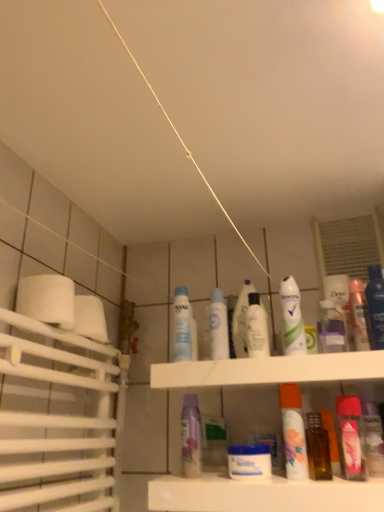
What is the approximate height of pink glossy mouthwash at lower right, which is the eighth mouthwash from left to right?

pink glossy mouthwash at lower right, which is the eighth mouthwash from left to right, is 7.21 inches tall.

This screenshot has width=384, height=512. I want to click on translucent plastic spray bottle at upper center, so pos(331,329).

In order to face purple matte mouthwash at center, the 8th mouthwash from the right, should I rotate leftwards or rightwards?

You should rotate left by 0.567 degrees.

The image size is (384, 512). Describe the element at coordinates (359, 314) in the screenshot. I see `translucent plastic mouthwash at upper right, which is the 9th mouthwash in left-to-right order` at that location.

I want to click on pink glossy mouthwash at lower right, which is the eighth mouthwash from left to right, so click(351, 436).

Is white matte toilet paper at left positioned with its back to transparent plastic mouthwash at center, the first mouthwash viewed from the left?

white matte toilet paper at left is not turned away from transparent plastic mouthwash at center, the first mouthwash viewed from the left.

Identify the location of toilet paper that appears above the transparent plastic mouthwash at center, which is the 9th mouthwash in right-to-left order (from a real-world perspective). (47, 298).

How much distance is there between white matte toilet paper at left and transparent plastic mouthwash at center, the first mouthwash viewed from the left?

white matte toilet paper at left and transparent plastic mouthwash at center, the first mouthwash viewed from the left, are 11.15 inches apart from each other.

In terms of height, does white matte toilet paper at left look taller or shorter compared to transparent plastic mouthwash at center, which is the 9th mouthwash in right-to-left order?

Considering their sizes, white matte toilet paper at left has less height than transparent plastic mouthwash at center, which is the 9th mouthwash in right-to-left order.

Which is in front, green matte mouthwash at upper center, the 3th mouthwash viewed from the right, or translucent plastic mouthwash at upper right, which is the 9th mouthwash in left-to-right order?

green matte mouthwash at upper center, the 3th mouthwash viewed from the right, is closer to the camera.

From a real-world perspective, which object rests below the other?

In real-world perspective, translucent plastic mouthwash at upper right, which is the 9th mouthwash in left-to-right order, is lower.

Locate an element on the screen. the 1st mouthwash directly beneath the green matte mouthwash at upper center, which is the 7th mouthwash in left-to-right order (from a real-world perspective) is located at coordinates (359, 314).

Is green matte mouthwash at upper center, the 3th mouthwash viewed from the right, spatially inside translucent plastic mouthwash at upper right, the first mouthwash from the right, or outside of it?

green matte mouthwash at upper center, the 3th mouthwash viewed from the right, is outside translucent plastic mouthwash at upper right, the first mouthwash from the right.

Considering the sizes of white glossy mouthwash at center, marked as the seventh mouthwash in a right-to-left arrangement, and white matte toilet paper at left in the image, is white glossy mouthwash at center, marked as the seventh mouthwash in a right-to-left arrangement, taller or shorter than white matte toilet paper at left?

white glossy mouthwash at center, marked as the seventh mouthwash in a right-to-left arrangement, is taller than white matte toilet paper at left.

Choose the correct answer: Is white glossy mouthwash at center, marked as the seventh mouthwash in a right-to-left arrangement, inside white matte toilet paper at left or outside it?

white glossy mouthwash at center, marked as the seventh mouthwash in a right-to-left arrangement, is not enclosed by white matte toilet paper at left.

Does white glossy mouthwash at center, which ranks as the 3th mouthwash in left-to-right order, appear on the right side of white matte toilet paper at left?

→ Correct, you'll find white glossy mouthwash at center, which ranks as the 3th mouthwash in left-to-right order, to the right of white matte toilet paper at left.

Is point (256, 348) closer or farther from the camera than point (32, 302)?

Point (256, 348) is positioned farther from the camera compared to point (32, 302).

You are a GUI agent. You are given a task and a screenshot of the screen. Output one action in this format:
    pyautogui.click(x=<x>, y=<y>)
    Task: Click on the toilet paper above the white glossy mouthwash at center, the fifth mouthwash in the left-to-right sequence (from the image's perspective)
    This screenshot has height=512, width=384.
    Given the screenshot: What is the action you would take?
    pyautogui.click(x=47, y=298)

How different are the orientations of white glossy mouthwash at center, the fifth mouthwash in the left-to-right sequence, and white matte toilet paper at left in degrees?

The angular difference between white glossy mouthwash at center, the fifth mouthwash in the left-to-right sequence, and white matte toilet paper at left is 90 degrees.

Does white glossy mouthwash at center, the fifth mouthwash in the left-to-right sequence, appear on the right side of white matte toilet paper at left?

Yes, white glossy mouthwash at center, the fifth mouthwash in the left-to-right sequence, is to the right of white matte toilet paper at left.

From a real-world perspective, is translucent plastic spray bottle at upper center physically located above or below white plastic shelf at center?

Clearly, from a real-world perspective, translucent plastic spray bottle at upper center is above white plastic shelf at center.

Which of these two, translucent plastic spray bottle at upper center or white plastic shelf at center, stands taller?

Standing taller between the two is white plastic shelf at center.

The width and height of the screenshot is (384, 512). I want to click on shelf below the translucent plastic spray bottle at upper center (from the image's perspective), so click(x=262, y=495).

Could white plastic shelf at center be considered to be inside translucent plastic spray bottle at upper center?

No, translucent plastic spray bottle at upper center does not contain white plastic shelf at center.

The image size is (384, 512). What are the coordinates of `the 4th mouthwash directly beneath the translucent plastic mouthwash at upper right, which is the 9th mouthwash in left-to-right order (from a real-world perspective)` in the screenshot? It's located at (351, 436).

From a real-world perspective, which is physically above, pink glossy mouthwash at lower right, the second mouthwash when ordered from right to left, or translucent plastic mouthwash at upper right, the first mouthwash from the right?

translucent plastic mouthwash at upper right, the first mouthwash from the right, is physically above.

Does pink glossy mouthwash at lower right, which is the eighth mouthwash from left to right, have a lesser width compared to translucent plastic mouthwash at upper right, the first mouthwash from the right?

Incorrect, the width of pink glossy mouthwash at lower right, which is the eighth mouthwash from left to right, is not less than that of translucent plastic mouthwash at upper right, the first mouthwash from the right.

Considering the points (341, 406) and (360, 291), which point is in front, point (341, 406) or point (360, 291)?

The point (341, 406) is in front.

Considering the relative sizes of translucent plastic bottle at center and white glossy jar at center, arranged as the fourth mouthwash when viewed from the left, in the image provided, is translucent plastic bottle at center thinner than white glossy jar at center, arranged as the fourth mouthwash when viewed from the left,?

Correct, the width of translucent plastic bottle at center is less than that of white glossy jar at center, arranged as the fourth mouthwash when viewed from the left.

Does point (234, 316) appear closer or farther from the camera than point (245, 461)?

Point (234, 316).

Can you tell me how much translucent plastic bottle at center and white glossy jar at center, which ranks as the 6th mouthwash in right-to-left order, differ in facing direction?

The facing directions of translucent plastic bottle at center and white glossy jar at center, which ranks as the 6th mouthwash in right-to-left order, are 0.000723 degrees apart.

Is translucent plastic bottle at center located outside white glossy jar at center, which ranks as the 6th mouthwash in right-to-left order?

Yes, translucent plastic bottle at center is located beyond the bounds of white glossy jar at center, which ranks as the 6th mouthwash in right-to-left order.

In order to click on toilet paper above the transparent plastic mouthwash at center, which is the 9th mouthwash in right-to-left order (from a real-world perspective) in this screenshot , I will do `click(47, 298)`.

From the image's perspective, which mouthwash is the 1st one below the green matte mouthwash at upper center, which is the 7th mouthwash in left-to-right order? Please provide its 2D coordinates.

[(359, 314)]

Consider the image. Based on their spatial positions, is white glossy mouthwash at center, marked as the seventh mouthwash in a right-to-left arrangement, or translucent orange spray can at center, acting as the 6th mouthwash starting from the left, closer to translucent plastic bottle at center?

white glossy mouthwash at center, marked as the seventh mouthwash in a right-to-left arrangement.

From the image, which object appears to be farther from white matte toilet paper at left, purple matte mouthwash at center, the 8th mouthwash from the right, or translucent plastic bottle at center?

translucent plastic bottle at center lies further to white matte toilet paper at left than the other object.

When comparing their distances from translucent plastic bottle at center, does green matte mouthwash at upper center, the 3th mouthwash viewed from the right, or translucent orange spray can at center, acting as the 6th mouthwash starting from the left, seem closer?

green matte mouthwash at upper center, the 3th mouthwash viewed from the right, is closer to translucent plastic bottle at center.

When comparing their distances from translucent plastic mouthwash at upper right, which is the 9th mouthwash in left-to-right order, does pink glossy mouthwash at lower right, the second mouthwash when ordered from right to left, or transparent plastic mouthwash at center, which is the 9th mouthwash in right-to-left order, seem closer?

The object closer to translucent plastic mouthwash at upper right, which is the 9th mouthwash in left-to-right order, is pink glossy mouthwash at lower right, the second mouthwash when ordered from right to left.

Based on their spatial positions, is white plastic shelf at center or translucent plastic mouthwash at upper right, which is the 9th mouthwash in left-to-right order, closer to green matte mouthwash at upper center, which is the 7th mouthwash in left-to-right order?

translucent plastic mouthwash at upper right, which is the 9th mouthwash in left-to-right order, is positioned closer to the anchor green matte mouthwash at upper center, which is the 7th mouthwash in left-to-right order.

Which object lies further to the anchor point green matte mouthwash at upper center, which is the 7th mouthwash in left-to-right order, translucent plastic mouthwash at upper right, the first mouthwash from the right, or translucent plastic bottle at center?

The object further to green matte mouthwash at upper center, which is the 7th mouthwash in left-to-right order, is translucent plastic mouthwash at upper right, the first mouthwash from the right.

Which object lies nearer to the anchor point white glossy mouthwash at center, which ranks as the 3th mouthwash in left-to-right order, purple matte mouthwash at center, which is the 2th mouthwash in left-to-right order, or pink glossy mouthwash at lower right, the second mouthwash when ordered from right to left?

The object closer to white glossy mouthwash at center, which ranks as the 3th mouthwash in left-to-right order, is purple matte mouthwash at center, which is the 2th mouthwash in left-to-right order.

Considering their positions, is translucent plastic spray bottle at upper center positioned further to translucent orange spray can at center, acting as the 6th mouthwash starting from the left, than purple matte mouthwash at center, which is the 2th mouthwash in left-to-right order?

Among the two, purple matte mouthwash at center, which is the 2th mouthwash in left-to-right order, is located further to translucent orange spray can at center, acting as the 6th mouthwash starting from the left.

Where is `cleaning product located between purple matte mouthwash at center, the 8th mouthwash from the right, and pink glossy mouthwash at lower right, the second mouthwash when ordered from right to left, in the left-right direction`? This screenshot has width=384, height=512. cleaning product located between purple matte mouthwash at center, the 8th mouthwash from the right, and pink glossy mouthwash at lower right, the second mouthwash when ordered from right to left, in the left-right direction is located at coordinates (331, 329).

Locate an element on the screen. The height and width of the screenshot is (512, 384). toiletry between translucent plastic mouthwash at upper right, the first mouthwash from the right, and translucent orange spray can at center, placed as the fourth mouthwash when sorted from right to left, in the up-down direction is located at coordinates (241, 320).

Identify the location of shelf located between white matte toilet paper at left and green matte mouthwash at upper center, the 3th mouthwash viewed from the right, in the left-right direction. This screenshot has height=512, width=384. (262, 495).

I want to click on shelf situated between transparent plastic mouthwash at center, which is the 9th mouthwash in right-to-left order, and translucent orange spray can at center, placed as the fourth mouthwash when sorted from right to left, from left to right, so click(262, 495).